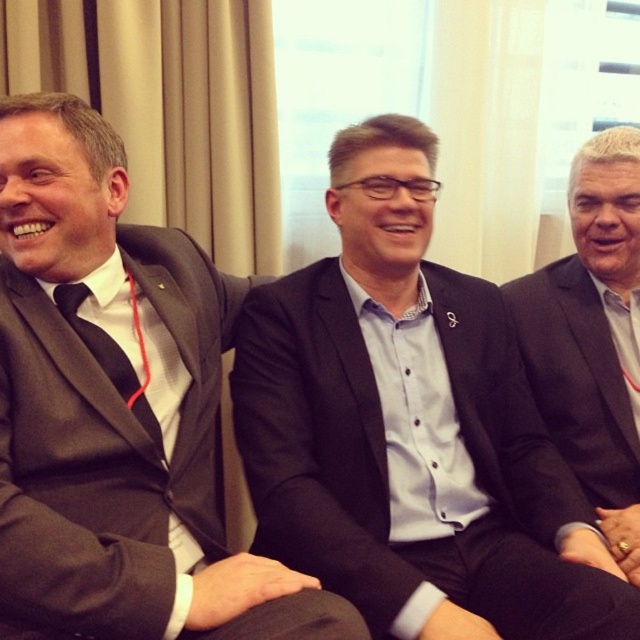
Question: Observing the image, what is the correct spatial positioning of matte black suit at left in reference to dark gray suit at right?

Choices:
 (A) right
 (B) left

Answer: (B)

Question: Which point is closer to the camera?

Choices:
 (A) dark gray suit at right
 (B) black matte suit at center
 (C) matte black suit at left
 (D) black satin tie at left

Answer: (C)

Question: Can you confirm if dark gray suit at right is positioned above black satin tie at left?

Choices:
 (A) yes
 (B) no

Answer: (A)

Question: Is the position of black matte suit at center less distant than that of dark gray suit at right?

Choices:
 (A) no
 (B) yes

Answer: (B)

Question: Which point appears farthest from the camera in this image?

Choices:
 (A) (88, 291)
 (B) (65, 557)
 (C) (544, 314)

Answer: (C)

Question: Among these objects, which one is nearest to the camera?

Choices:
 (A) black satin tie at left
 (B) black matte suit at center
 (C) dark gray suit at right

Answer: (B)